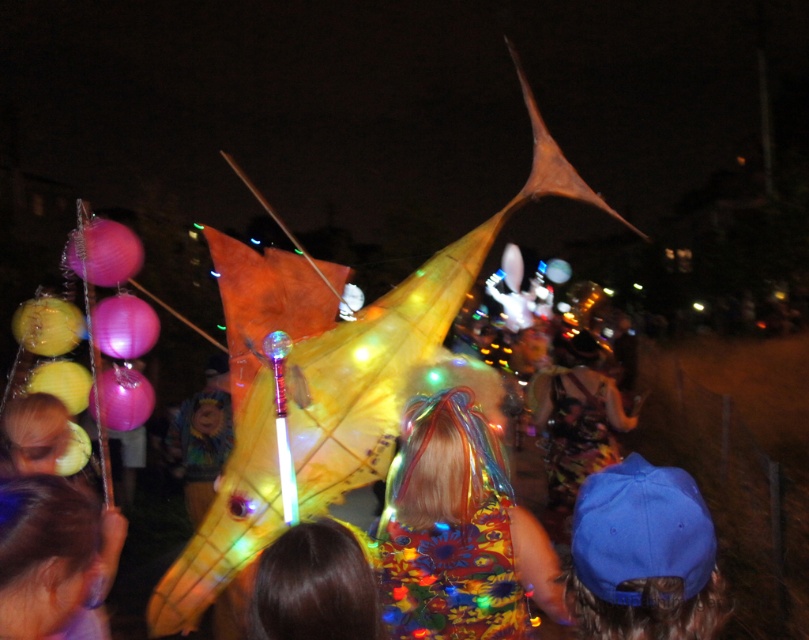
In the scene shown: Is brown hair at center bigger than floral dress at center?

No.

Between brown hair at center and floral dress at center, which one is positioned higher?

brown hair at center is above.

Is point (299, 600) behind point (564, 458)?

That is False.

Locate an element on the screen. The width and height of the screenshot is (809, 640). brown hair at center is located at coordinates (314, 586).

Is blonde hair at center bigger than brown hair at center?

No, blonde hair at center is not bigger than brown hair at center.

Which is in front, point (15, 573) or point (323, 614)?

Point (15, 573) is more forward.

Identify the location of blonde hair at center. This screenshot has height=640, width=809. (49, 552).

Does blue fabric cap at center come behind floral dress at center?

No, blue fabric cap at center is in front of floral dress at center.

Who is more distant from viewer, (611, 586) or (593, 419)?

Positioned behind is point (593, 419).

In order to click on blue fabric cap at center in this screenshot , I will do `click(644, 556)`.